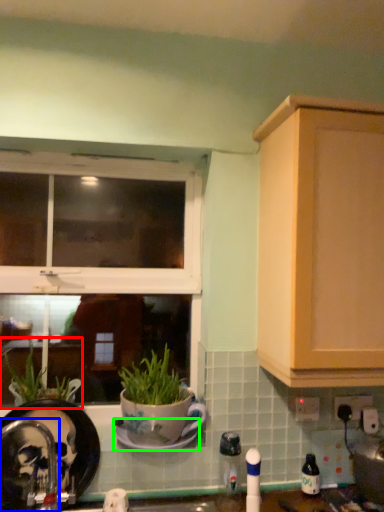
Question: Considering the real-world distances, which object is farthest from houseplant (highlighted by a red box)? faucet (highlighted by a blue box) or saucer (highlighted by a green box)?

Choices:
 (A) faucet
 (B) saucer

Answer: (B)